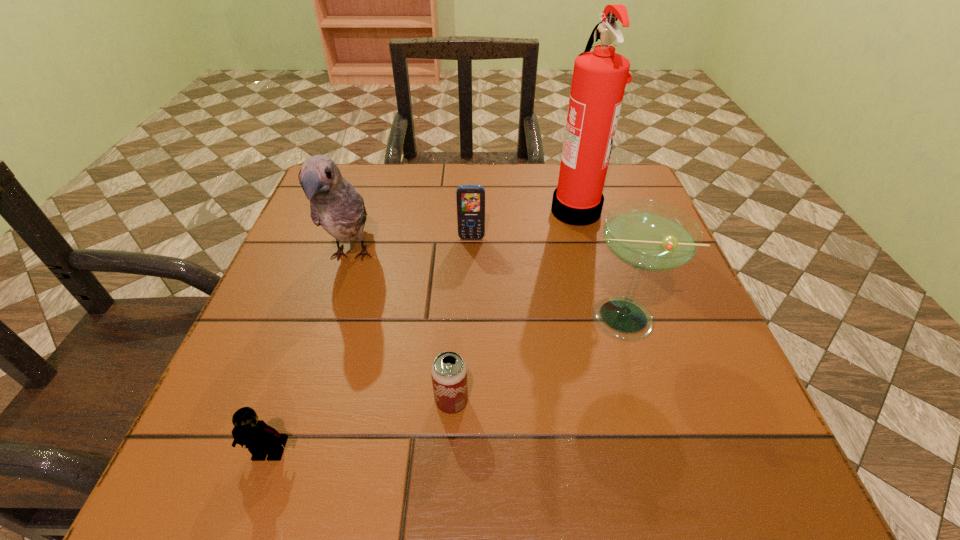
Locate an element on the screen. This screenshot has width=960, height=540. free space between the fifth farthest object and the tallest object is located at coordinates (514, 305).

Identify the location of free space between the third shortest object and the second nearest object. (462, 320).

Find the location of `vacant area that lies between the parrot and the nearest object`. vacant area that lies between the parrot and the nearest object is located at coordinates (310, 355).

Locate an element on the screen. free space between the tallest object and the nearest object is located at coordinates (422, 331).

Find the location of a particular element. object that stands as the third closest to the nearest object is located at coordinates (647, 235).

Select which object is the second closest to the cellular telephone. Please provide its 2D coordinates. Your answer should be formatted as a tuple, i.e. [(x, y)], where the tuple contains the x and y coordinates of a point satisfying the conditions above.

[(334, 203)]

Locate an element on the screen. vacant region that satisfies the following two spatial constraints: 1. with the nozzle aimed from the fourth shortest object; 2. on the left side of the fire extinguisher is located at coordinates (604, 318).

You are a GUI agent. You are given a task and a screenshot of the screen. Output one action in this format:
    pyautogui.click(x=<x>, y=<y>)
    Task: Click on the vacant space that satisfies the following two spatial constraints: 1. with the nozzle aimed from the tallest object; 2. on the face of the nearest object
    Image resolution: width=960 pixels, height=540 pixels.
    Given the screenshot: What is the action you would take?
    pyautogui.click(x=640, y=453)

At what (x,y) coordinates should I click in order to perform the action: click on free space that satisfies the following two spatial constraints: 1. with the nozzle aimed from the fire extinguisher; 2. on the screen of the cellular telephone. Please return your answer as a coordinate pair (x, y). The width and height of the screenshot is (960, 540). Looking at the image, I should click on (583, 238).

The image size is (960, 540). I want to click on vacant space that satisfies the following two spatial constraints: 1. on the back side of the martini; 2. on the left side of the beer can, so click(x=456, y=318).